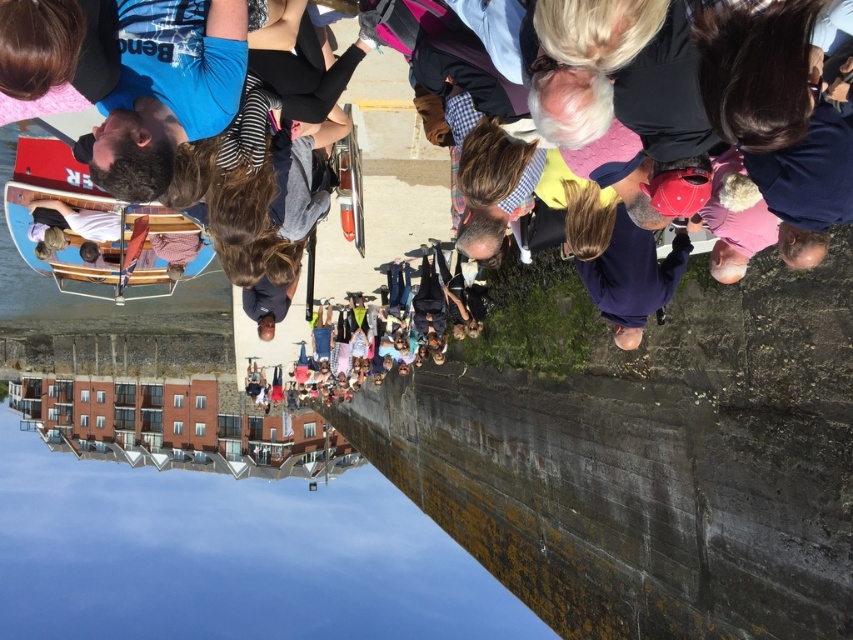
You are a photographer trying to capture a wide shot of the wooden boat at center and the smooth concrete waterway at lower left. Based on their sizes, which object would appear more prominent in the photo?

The smooth concrete waterway at lower left appears more prominent in the photo because its width is larger than the wooden boat at center.

You are a photographer trying to capture the wooden boat at center and the smooth concrete waterway at lower left in a single shot. Based on their positions, which object should you focus on first to ensure both are in frame?

The wooden boat at center is behind the smooth concrete waterway at lower left, so you should focus on the smooth concrete waterway at lower left first to ensure both are in frame.